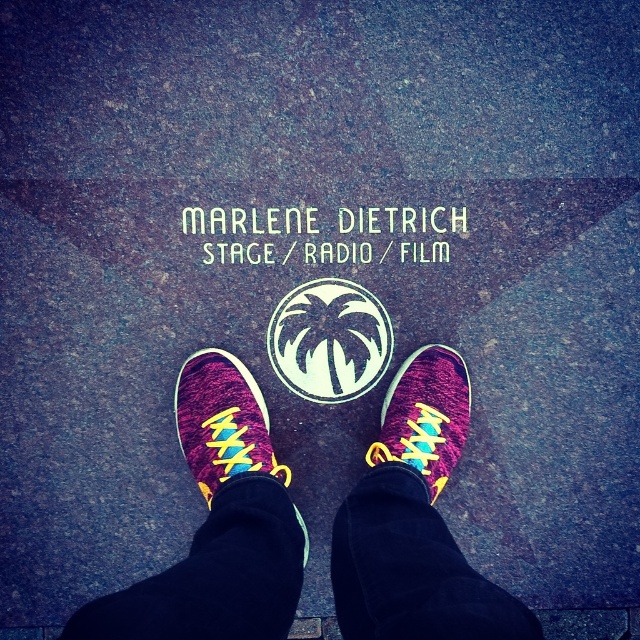
Does point (192, 392) come farther from viewer compared to point (394, 444)?

Yes, it is behind point (394, 444).

What do you see at coordinates (218, 525) in the screenshot? This screenshot has height=640, width=640. I see `knitted sneakers at center` at bounding box center [218, 525].

Locate an element on the screen. knitted sneakers at center is located at coordinates (218, 525).

At what (x,y) coordinates should I click in order to perform the action: click on knitted sneakers at center. Please return your answer as a coordinate pair (x, y). The height and width of the screenshot is (640, 640). Looking at the image, I should click on (218, 525).

Can you confirm if knit fabric sneaker at center is bigger than whitematerial/texturetext at center?

Correct, knit fabric sneaker at center is larger in size than whitematerial/texturetext at center.

Does knit fabric sneaker at center come behind whitematerial/texturetext at center?

No, knit fabric sneaker at center is in front of whitematerial/texturetext at center.

The height and width of the screenshot is (640, 640). I want to click on knit fabric sneaker at center, so click(426, 416).

Can you confirm if knitted suede sneaker at center is positioned above knit fabric sneaker at center?

Incorrect, knitted suede sneaker at center is not positioned above knit fabric sneaker at center.

Which is in front, point (248, 467) or point (460, 403)?

Point (248, 467) is more forward.

The width and height of the screenshot is (640, 640). What are the coordinates of `knitted suede sneaker at center` in the screenshot? It's located at (221, 420).